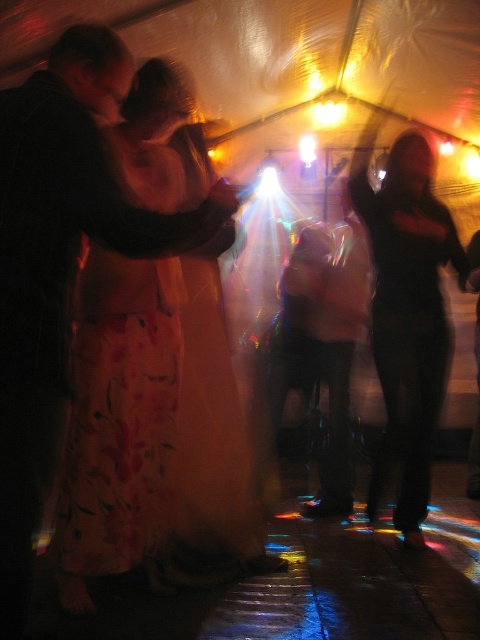
Question: Which is nearer to the black matte dress at center?

Choices:
 (A) matte black jacket at left
 (B) floral silk dress at center

Answer: (B)

Question: Which point is farther from the camera taking this photo?

Choices:
 (A) (408, 364)
 (B) (160, 256)
 (C) (73, 484)

Answer: (A)

Question: Is matte black jacket at left bigger than black matte dress at center?

Choices:
 (A) yes
 (B) no

Answer: (A)

Question: Is matte black jacket at left to the left of black matte dress at center from the viewer's perspective?

Choices:
 (A) yes
 (B) no

Answer: (A)

Question: Can you confirm if floral silk dress at center is positioned below black matte dress at center?

Choices:
 (A) yes
 (B) no

Answer: (A)

Question: Which of the following is the farthest from the observer?

Choices:
 (A) floral silk dress at center
 (B) black matte dress at center

Answer: (B)